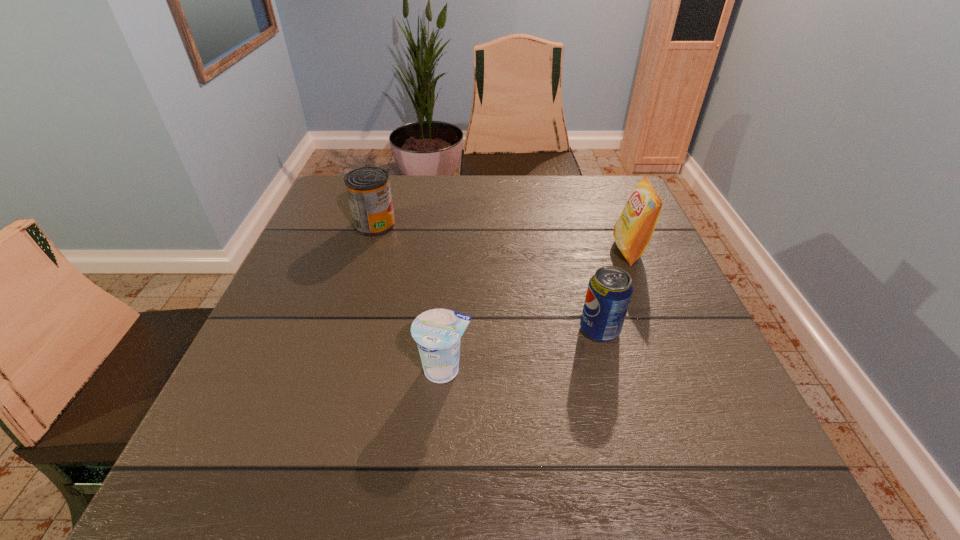
Locate an element on the screen. free region at the right edge of the desktop is located at coordinates (662, 278).

Where is `free spot at the near left corner of the desktop`? The width and height of the screenshot is (960, 540). free spot at the near left corner of the desktop is located at coordinates (228, 496).

Find the location of a particular element. free space at the far right corner of the desktop is located at coordinates (582, 178).

You are a GUI agent. You are given a task and a screenshot of the screen. Output one action in this format:
    pyautogui.click(x=<x>, y=<y>)
    Task: Click on the empty space that is in between the can and the tallest object
    The image size is (960, 540).
    Given the screenshot: What is the action you would take?
    pyautogui.click(x=502, y=238)

Where is `blank region between the tallest object and the can`? The width and height of the screenshot is (960, 540). blank region between the tallest object and the can is located at coordinates [502, 238].

Find the location of a particular element. The height and width of the screenshot is (540, 960). vacant point located between the second object from right to left and the can is located at coordinates (488, 277).

You are a GUI agent. You are given a task and a screenshot of the screen. Output one action in this format:
    pyautogui.click(x=<x>, y=<y>)
    Task: Click on the unoccupied position between the soda and the nearest object
    
    Given the screenshot: What is the action you would take?
    pyautogui.click(x=522, y=350)

Image resolution: width=960 pixels, height=540 pixels. What are the coordinates of `vacant point located between the third object from right to left and the soda` in the screenshot? It's located at (522, 350).

The image size is (960, 540). Find the location of `unoccupied position between the yogurt and the leftmost object`. unoccupied position between the yogurt and the leftmost object is located at coordinates (410, 297).

The width and height of the screenshot is (960, 540). Find the location of `vacant area that lies between the tallest object and the shortest object`. vacant area that lies between the tallest object and the shortest object is located at coordinates (537, 310).